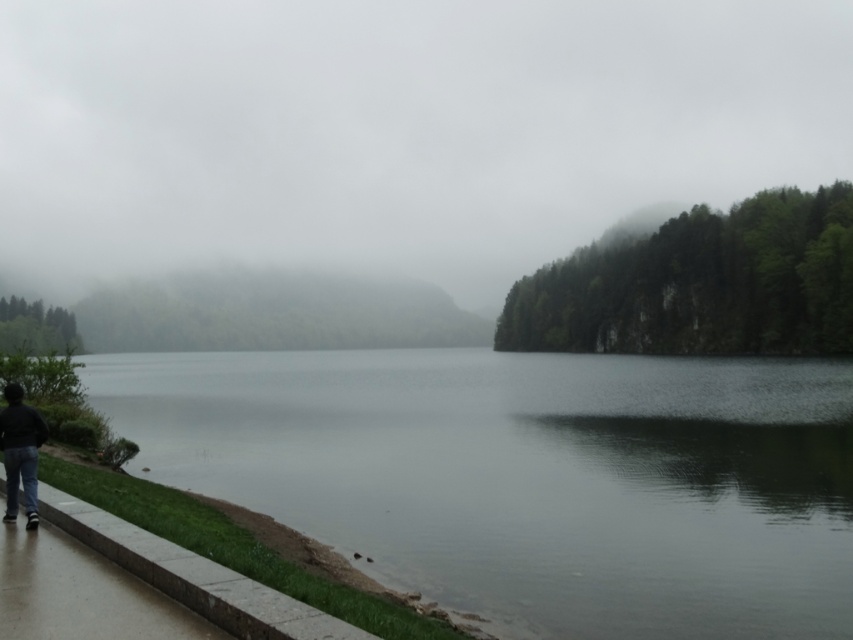
You are a hiker who wants to cross the smooth gray water at center. You have a 1.2 meter wide plank. Can you use it to cross the water if the dark blue jeans at lower left are on the other side?

The smooth gray water at center might be wider than dark blue jeans at lower left. Since the plank is 1.2 meters wide, it depends on the actual width of the water. If the water is wider than 1.2 meters, the plank won

You are standing on the path near the dark blue jeans at lower left and want to cross to the forest on the right. Is the smooth gray water at center between you and the forest?

The smooth gray water at center is to the left of dark blue jeans at lower left, meaning it is not between you and the forest on the right. You can walk towards the forest without crossing the water.